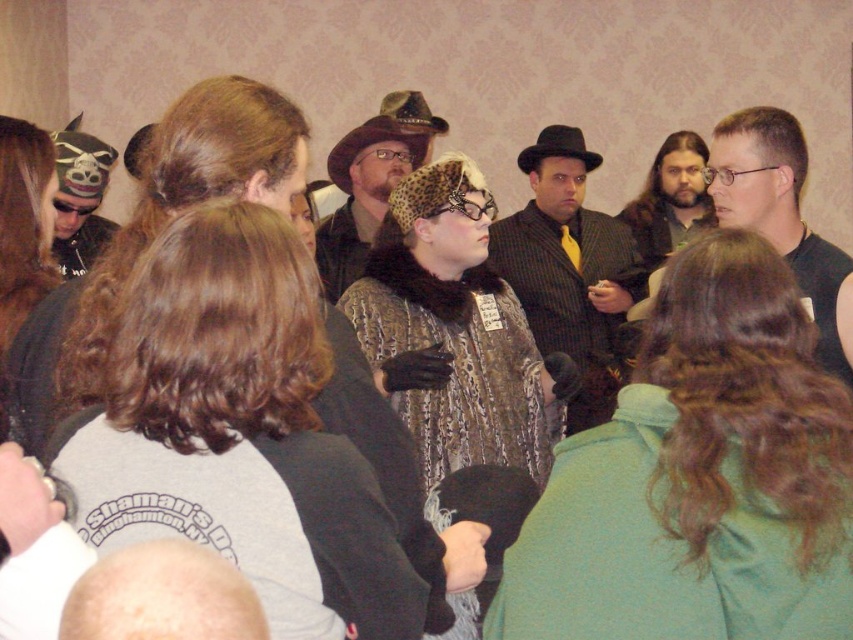
You are standing in the room and want to find the black matte shirt at right. According to the coordinates provided, where should you look relative to the room?

The black matte shirt at right is located at point coordinates 0.339 along the horizontal axis and 0.918 along the vertical axis, so you should look towards the lower right area of the room.

You are a photographer trying to capture a candid shot of the black matte shirt at right and the black felt cowboy hat at center. Since you want to ensure both subjects are in focus, you need to know their vertical positions. Can you tell me which is higher in the image?

The black felt cowboy hat at center is higher than the black matte shirt at right because the black matte shirt at right is positioned under the black felt cowboy hat at center.

You are organizing a clothing display and need to decide which item takes up more space horizontally. Based on the scene, which item is wider between the black matte shirt at right and the matte black hat at left?

The black matte shirt at right is wider than the matte black hat at left according to the description.